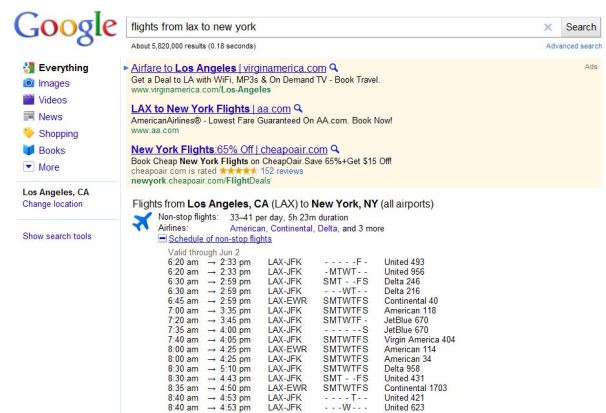
At what (x,y) coordinates should I click in order to perform the action: click on side bar. Please return your answer as a coordinate pair (x, y). The image size is (606, 413). Looking at the image, I should click on (48, 104).